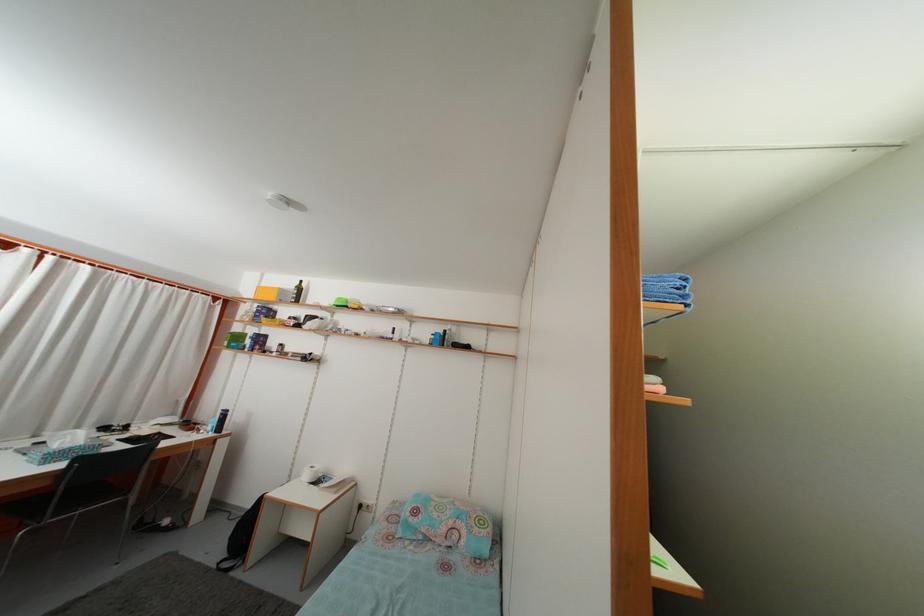
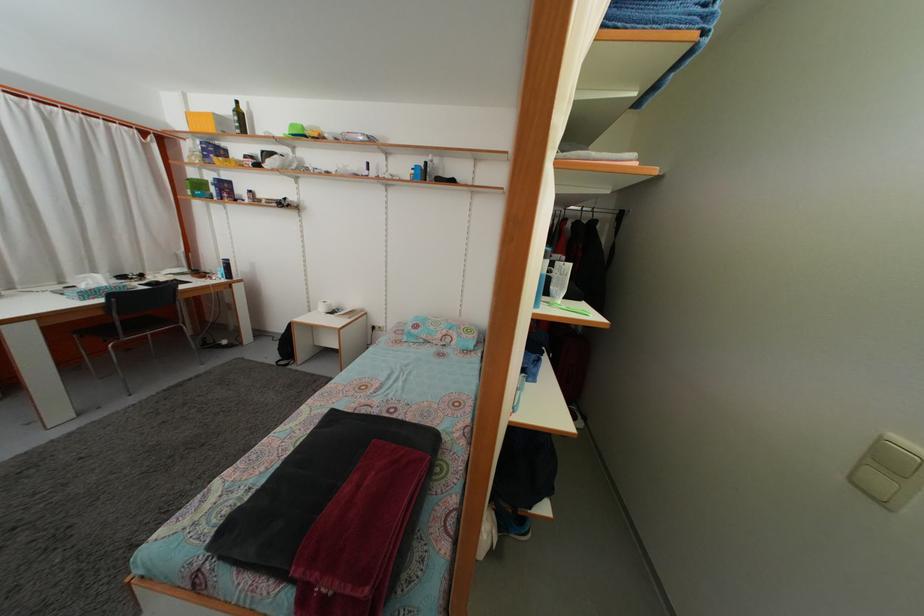
Locate, in the second image, the point that corresponds to point (265, 296) in the first image.

(196, 123)